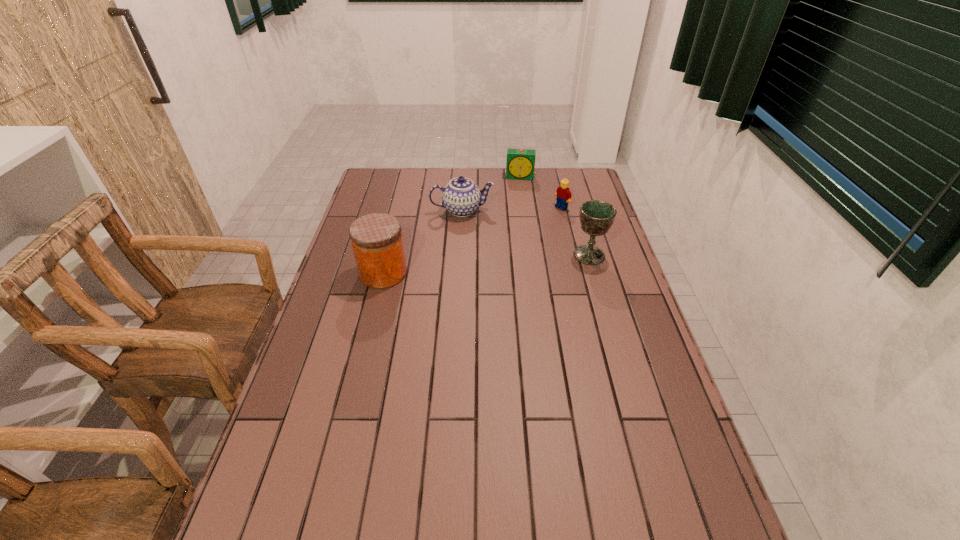
At what (x,y) coordinates should I click in order to perform the action: click on the leftmost object. Please return your answer as a coordinate pair (x, y). The height and width of the screenshot is (540, 960). Looking at the image, I should click on (376, 239).

At what (x,y) coordinates should I click in order to perform the action: click on chalice. Please return your answer as a coordinate pair (x, y). Looking at the image, I should click on (596, 217).

I want to click on the third object from left to right, so click(520, 164).

Locate an element on the screen. alarm clock is located at coordinates (520, 164).

Find the location of `Lego`. Lego is located at coordinates pyautogui.click(x=563, y=194).

Identify the location of the third shortest object. The height and width of the screenshot is (540, 960). (461, 197).

Where is `chinaware`? chinaware is located at coordinates (461, 197).

Find the location of a particular element. The image size is (960, 540). vacant space situated on the front of the jar is located at coordinates (371, 326).

Find the location of `vacant point located on the left of the chalice`. vacant point located on the left of the chalice is located at coordinates (497, 255).

The image size is (960, 540). I want to click on blank space located 0.330m on the front-facing side of the farthest object, so click(x=516, y=227).